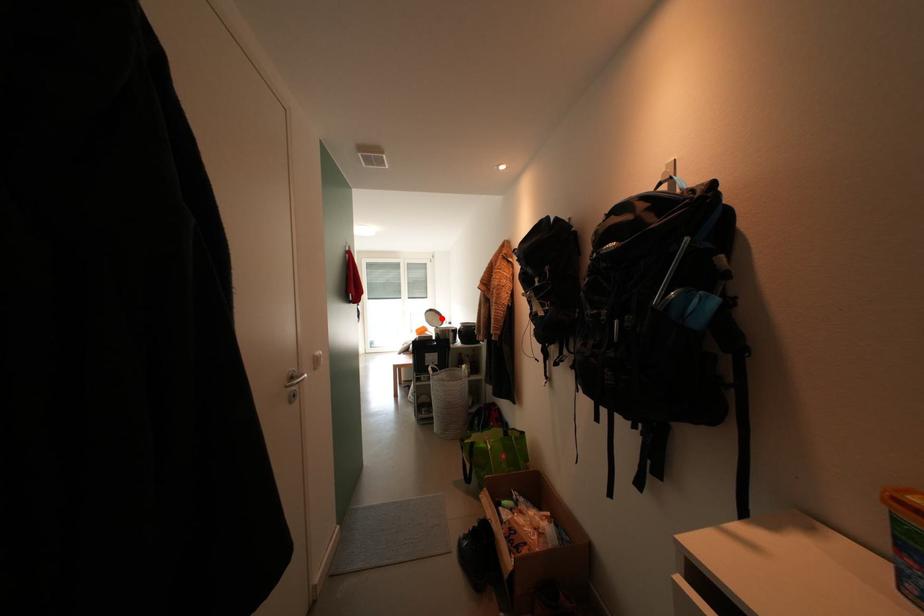
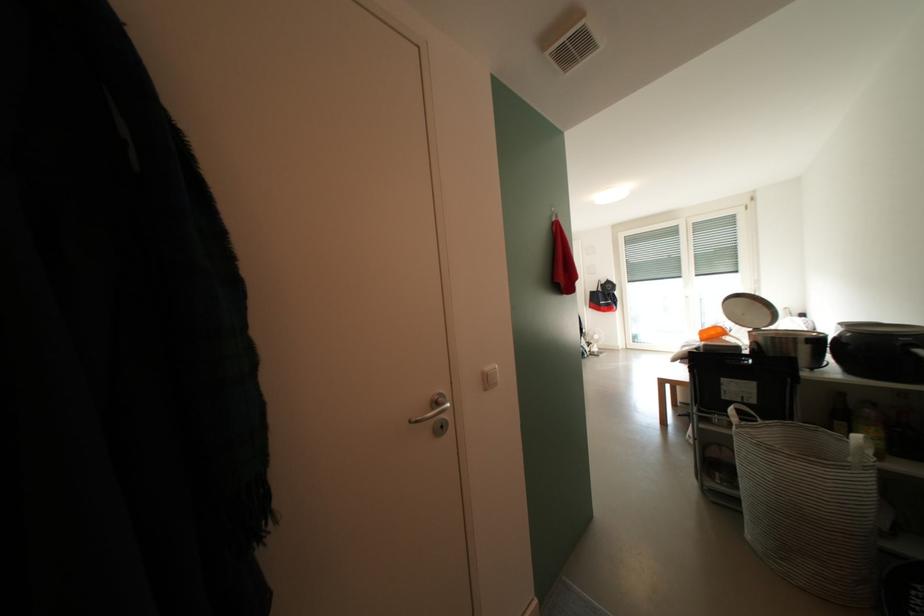
In the second image, find the point that corresponds to the highlighted location in the first image.

(756, 308)